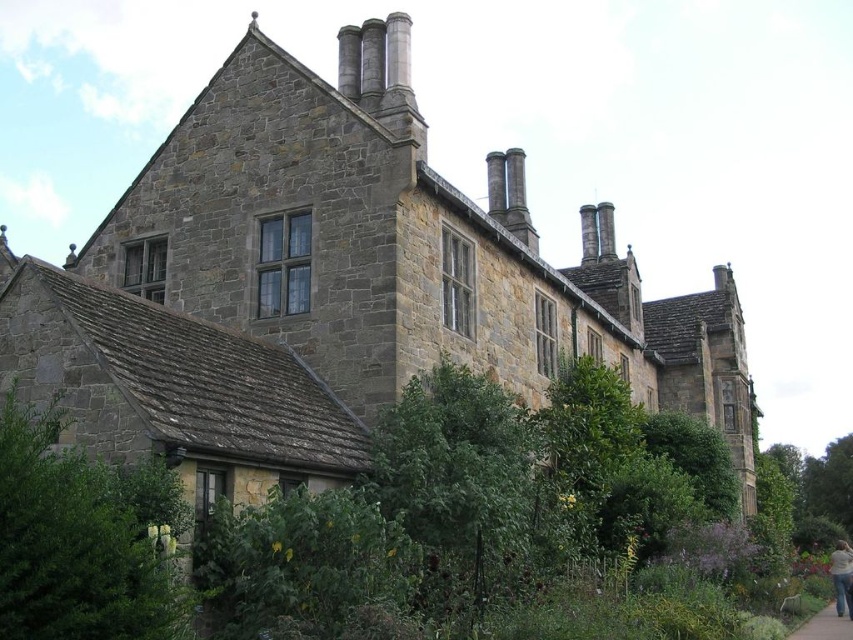
Is gray concrete pavement at lower right closer to camera compared to light pink fabric at lower right?

Yes, gray concrete pavement at lower right is closer to the viewer.

Between gray concrete pavement at lower right and light pink fabric at lower right, which one appears on the right side from the viewer's perspective?

Positioned to the right is light pink fabric at lower right.

Does point (844, 625) lie in front of point (840, 588)?

Yes, point (844, 625) is closer to viewer.

What are the coordinates of `gray concrete pavement at lower right` in the screenshot? It's located at (824, 627).